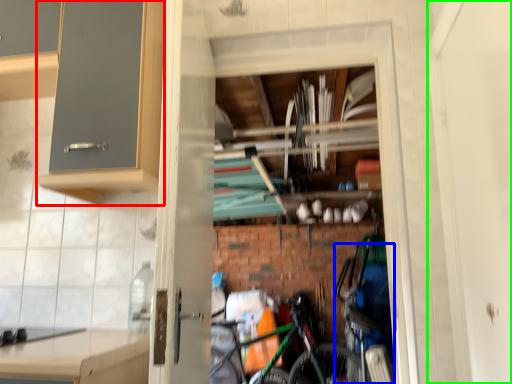
Question: Which is nearer to the cabinetry (highlighted by a red box)? bicycle (highlighted by a blue box) or screen door (highlighted by a green box).

Choices:
 (A) bicycle
 (B) screen door

Answer: (B)